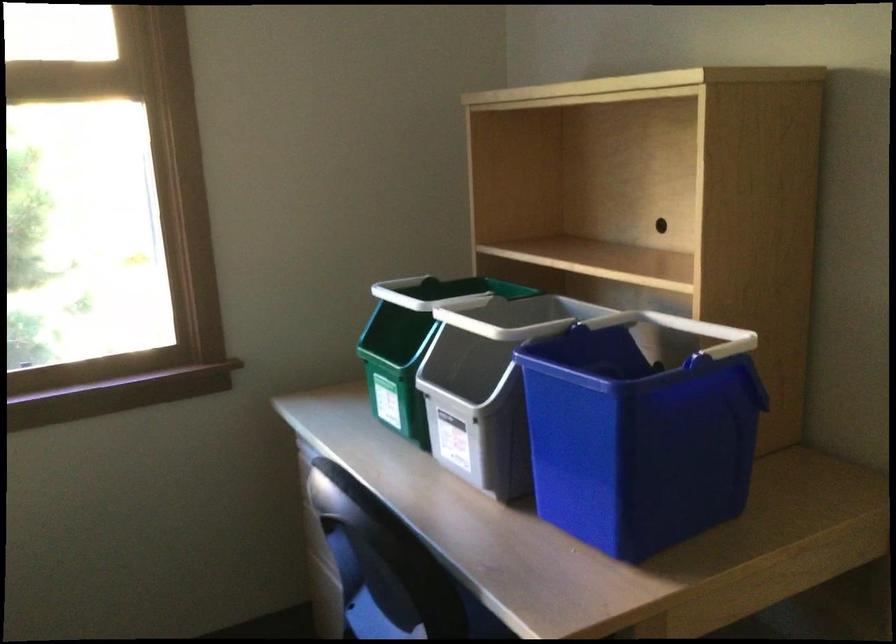
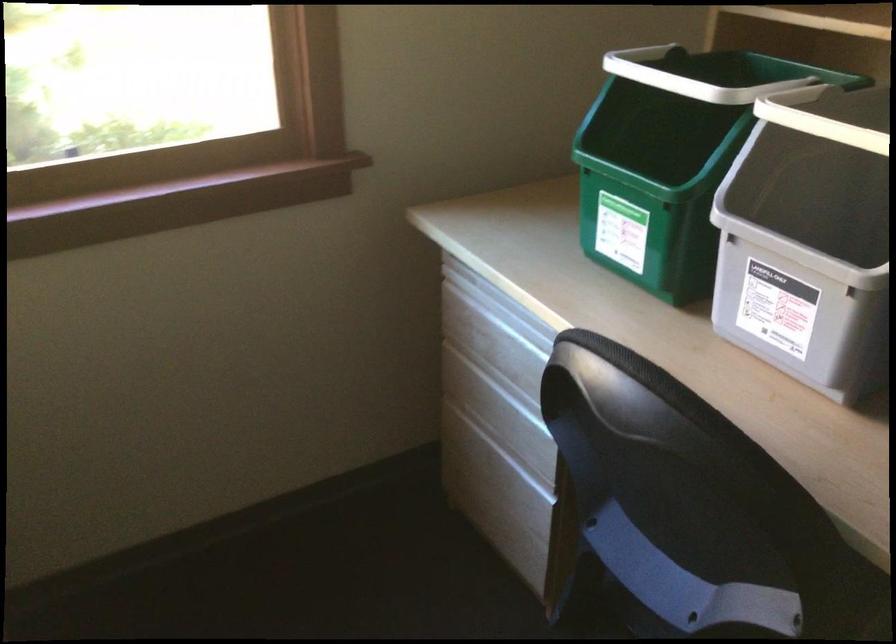
The point at (452, 401) is marked in the first image. Where is the corresponding point in the second image?

(797, 250)